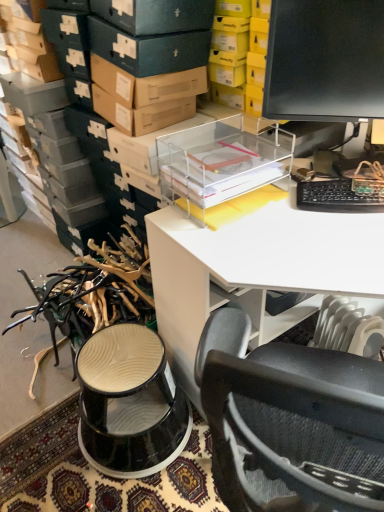
Question: Can you confirm if black glossy monitor at upper right is taller than transparent plastic desk at upper center?

Choices:
 (A) no
 (B) yes

Answer: (A)

Question: Can you confirm if black glossy monitor at upper right is positioned to the left of transparent plastic desk at upper center?

Choices:
 (A) yes
 (B) no

Answer: (A)

Question: Is the depth of black glossy monitor at upper right less than that of transparent plastic desk at upper center?

Choices:
 (A) no
 (B) yes

Answer: (A)

Question: Is black glossy monitor at upper right wider than transparent plastic desk at upper center?

Choices:
 (A) no
 (B) yes

Answer: (A)

Question: Is black glossy monitor at upper right facing away from transparent plastic desk at upper center?

Choices:
 (A) no
 (B) yes

Answer: (A)

Question: Based on their positions, is black plastic keyboard at right located to the left or right of black glossy monitor at upper right?

Choices:
 (A) right
 (B) left

Answer: (A)

Question: Looking at their shapes, would you say black plastic keyboard at right is wider or thinner than black glossy monitor at upper right?

Choices:
 (A) wide
 (B) thin

Answer: (A)

Question: From a real-world perspective, is black plastic keyboard at right physically located above or below black glossy monitor at upper right?

Choices:
 (A) below
 (B) above

Answer: (A)

Question: In terms of size, does black plastic keyboard at right appear bigger or smaller than black glossy monitor at upper right?

Choices:
 (A) big
 (B) small

Answer: (B)

Question: Is transparent plastic desk at upper center wider or thinner than black glossy monitor at upper right?

Choices:
 (A) wide
 (B) thin

Answer: (A)

Question: From a real-world perspective, relative to black glossy monitor at upper right, is transparent plastic desk at upper center vertically above or below?

Choices:
 (A) above
 (B) below

Answer: (B)

Question: From their relative heights in the image, would you say transparent plastic desk at upper center is taller or shorter than black glossy monitor at upper right?

Choices:
 (A) short
 (B) tall

Answer: (B)

Question: Would you say transparent plastic desk at upper center is inside or outside black glossy monitor at upper right?

Choices:
 (A) outside
 (B) inside

Answer: (A)

Question: Considering the positions of point (258, 232) and point (314, 181), is point (258, 232) closer or farther from the camera than point (314, 181)?

Choices:
 (A) farther
 (B) closer

Answer: (B)

Question: Is transparent plastic desk at upper center situated inside black plastic keyboard at right or outside?

Choices:
 (A) outside
 (B) inside

Answer: (A)